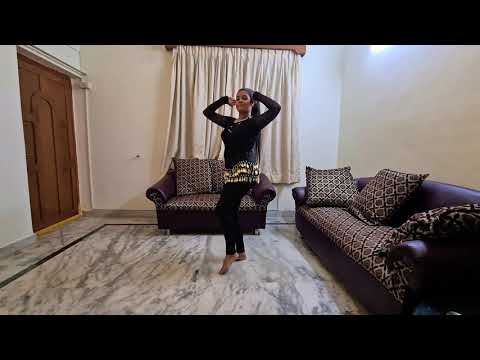
The height and width of the screenshot is (360, 480). In order to click on curtain in this screenshot , I will do `click(262, 69)`, `click(207, 67)`.